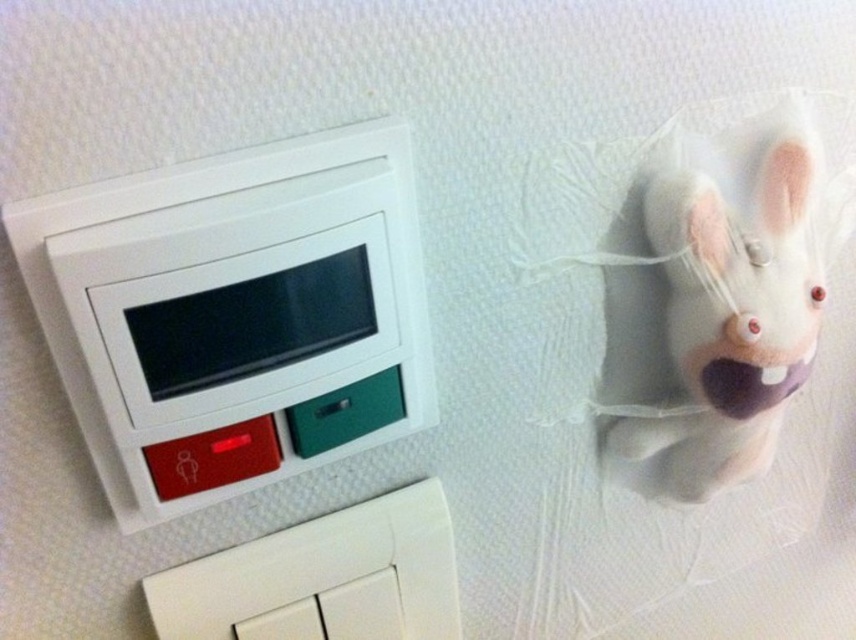
You are an interior designer assessing the wall layout. The white felt rabbit at upper right and the white plastic switch at lower left are both on the wall. Which object has a smaller width?

The white felt rabbit at upper right has a lesser width compared to the white plastic switch at lower left, so the white felt rabbit at upper right is smaller in width.

You are an electrician inspecting a wall panel. You need to locate the switches. Which switch is more to the left, the white plastic light switch at upper left or the white plastic switch at lower left?

The white plastic light switch at upper left is positioned on the left side of the white plastic switch at lower left, so it is more to the left.

You are standing in front of a wall with a white plastic light switch at upper left and a white felt rabbit at upper right. Which object is located higher up on the wall?

The white felt rabbit at upper right is positioned higher up on the wall than the white plastic light switch at upper left.